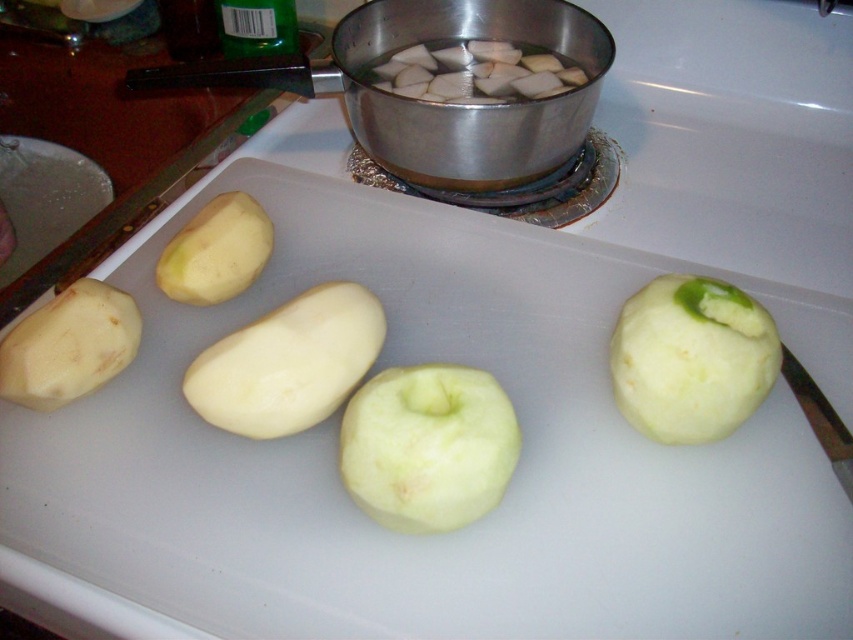
Is green matte apple at center below green matte apple at center-right?

Indeed, green matte apple at center is positioned under green matte apple at center-right.

Does green matte apple at center appear over green matte apple at center-right?

Incorrect, green matte apple at center is not positioned above green matte apple at center-right.

Describe the element at coordinates (428, 445) in the screenshot. I see `green matte apple at center` at that location.

Find the location of a particular element. Image resolution: width=853 pixels, height=640 pixels. green matte apple at center is located at coordinates (428, 445).

Does green matte apple at center-right have a lesser height compared to smooth white potato at center?

In fact, green matte apple at center-right may be taller than smooth white potato at center.

Can you confirm if green matte apple at center-right is positioned to the right of smooth white potato at center?

Correct, you'll find green matte apple at center-right to the right of smooth white potato at center.

The width and height of the screenshot is (853, 640). What do you see at coordinates (691, 358) in the screenshot?
I see `green matte apple at center-right` at bounding box center [691, 358].

The height and width of the screenshot is (640, 853). I want to click on green matte apple at center-right, so (x=691, y=358).

Who is higher up, smooth white potato at center or smooth white potato at lower left?

Positioned higher is smooth white potato at lower left.

Does point (352, 305) come farther from viewer compared to point (56, 365)?

Yes, point (352, 305) is behind point (56, 365).

This screenshot has height=640, width=853. I want to click on smooth white potato at center, so click(x=288, y=364).